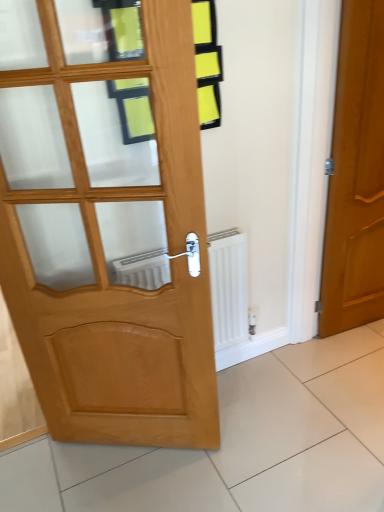
Question: Is the position of glossy wood door at right, the 1th door from the right, more distant than that of light brown wooden door at left, which is counted as the 2th door, starting from the right?

Choices:
 (A) yes
 (B) no

Answer: (A)

Question: Could you tell me if glossy wood door at right, which appears as the 2th door when viewed from the left, is turned towards light brown wooden door at left, acting as the first door starting from the left?

Choices:
 (A) yes
 (B) no

Answer: (B)

Question: Does glossy wood door at right, the 1th door from the right, have a larger size compared to light brown wooden door at left, which is counted as the 2th door, starting from the right?

Choices:
 (A) yes
 (B) no

Answer: (A)

Question: Is glossy wood door at right, the 1th door from the right, at the left side of light brown wooden door at left, which is counted as the 2th door, starting from the right?

Choices:
 (A) no
 (B) yes

Answer: (A)

Question: Is glossy wood door at right, the 1th door from the right, oriented away from light brown wooden door at left, acting as the first door starting from the left?

Choices:
 (A) no
 (B) yes

Answer: (A)

Question: Is glossy wood door at right, which appears as the 2th door when viewed from the left, positioned far away from light brown wooden door at left, which is counted as the 2th door, starting from the right?

Choices:
 (A) yes
 (B) no

Answer: (A)

Question: From a real-world perspective, does light brown wooden door at left, acting as the first door starting from the left, sit lower than glossy wood door at right, the 1th door from the right?

Choices:
 (A) no
 (B) yes

Answer: (A)

Question: Is light brown wooden door at left, which is counted as the 2th door, starting from the right, oriented towards glossy wood door at right, which appears as the 2th door when viewed from the left?

Choices:
 (A) yes
 (B) no

Answer: (B)

Question: Can you confirm if light brown wooden door at left, which is counted as the 2th door, starting from the right, is shorter than glossy wood door at right, the 1th door from the right?

Choices:
 (A) no
 (B) yes

Answer: (A)

Question: Does light brown wooden door at left, acting as the first door starting from the left, come in front of glossy wood door at right, which appears as the 2th door when viewed from the left?

Choices:
 (A) no
 (B) yes

Answer: (B)

Question: Would you say light brown wooden door at left, which is counted as the 2th door, starting from the right, is a long distance from glossy wood door at right, which appears as the 2th door when viewed from the left?

Choices:
 (A) no
 (B) yes

Answer: (B)

Question: Can you confirm if light brown wooden door at left, which is counted as the 2th door, starting from the right, is positioned to the left of glossy wood door at right, which appears as the 2th door when viewed from the left?

Choices:
 (A) no
 (B) yes

Answer: (B)

Question: Is white matte radiator at center positioned with its back to glossy wood door at right, the 1th door from the right?

Choices:
 (A) yes
 (B) no

Answer: (B)